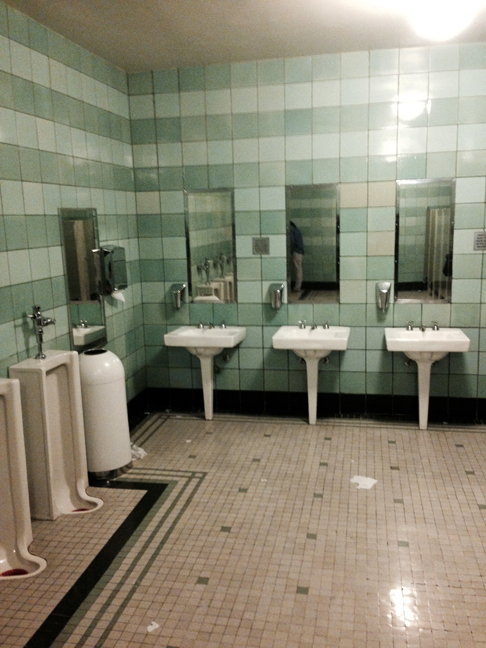
At what (x,y) coordinates should I click in order to perform the action: click on faucet. Please return your answer as a coordinate pair (x, y). This screenshot has width=486, height=648. Looking at the image, I should click on (197, 321), (223, 323), (298, 324), (329, 325), (408, 330), (438, 330).